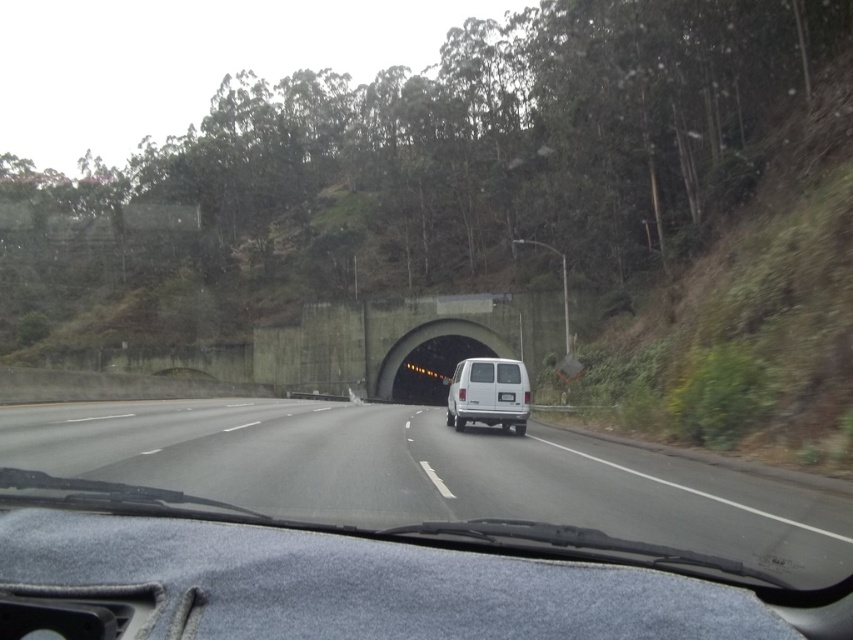
Is the position of white matte van at center more distant than that of concrete tunnel at center?

No, it is not.

What are the coordinates of `white matte van at center` in the screenshot? It's located at (488, 394).

Can you confirm if smooth asphalt highway at center is wider than concrete tunnel at center?

Indeed, smooth asphalt highway at center has a greater width compared to concrete tunnel at center.

Does point (397, 474) come closer to viewer compared to point (389, 376)?

Yes, point (397, 474) is in front of point (389, 376).

Who is more forward, (166, 468) or (413, 337)?

Positioned in front is point (166, 468).

Locate an element on the screen. smooth asphalt highway at center is located at coordinates (428, 474).

Between point (546, 516) and point (450, 380), which one is positioned in front?

Point (546, 516) is more forward.

The image size is (853, 640). What are the coordinates of `smooth asphalt highway at center` in the screenshot? It's located at (428, 474).

At what (x,y) coordinates should I click in order to perform the action: click on smooth asphalt highway at center. Please return your answer as a coordinate pair (x, y). This screenshot has width=853, height=640. Looking at the image, I should click on (428, 474).